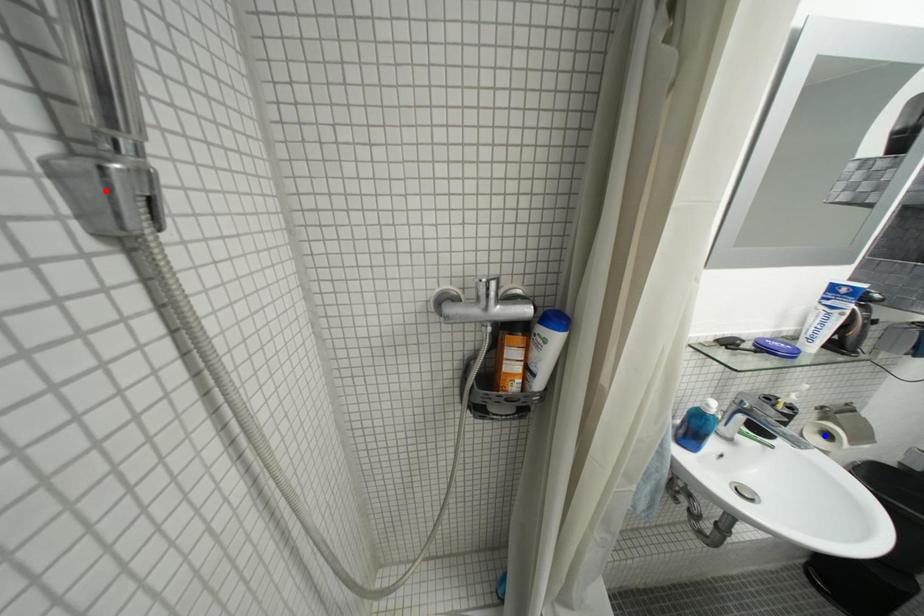
Question: Which of the two points in the image is closer to the camera?

Choices:
 (A) Blue point is closer.
 (B) Red point is closer.

Answer: (B)